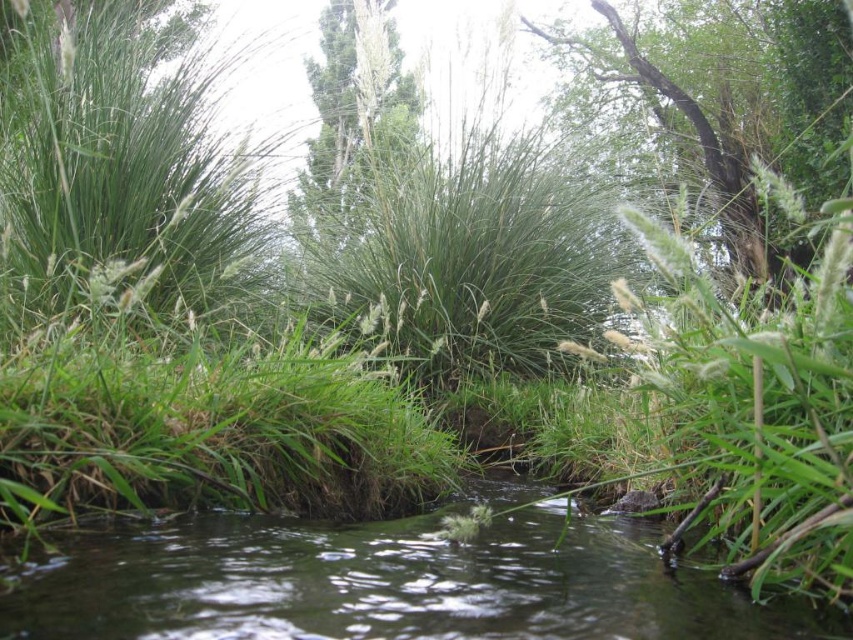
Between green grassy river at center and green grassy plant at upper center, which one has less height?

green grassy river at center

Which is more to the left, green grassy river at center or green grassy plant at upper center?

From the viewer's perspective, green grassy plant at upper center appears more on the left side.

Which is behind, point (25, 608) or point (332, 20)?

Point (332, 20)

The image size is (853, 640). I want to click on green grassy river at center, so click(x=387, y=584).

This screenshot has width=853, height=640. Identify the location of green grassy river at center. tap(387, 584).

Which of these two, green grassy river at center or green rough bark tree at upper center, stands taller?

With more height is green rough bark tree at upper center.

This screenshot has height=640, width=853. What do you see at coordinates (387, 584) in the screenshot? I see `green grassy river at center` at bounding box center [387, 584].

This screenshot has width=853, height=640. In order to click on green grassy river at center in this screenshot , I will do `click(387, 584)`.

Does green grassy plant at upper center come behind green rough bark tree at upper center?

No, green grassy plant at upper center is in front of green rough bark tree at upper center.

Is green grassy plant at upper center to the right of green rough bark tree at upper center from the viewer's perspective?

In fact, green grassy plant at upper center is to the left of green rough bark tree at upper center.

Where is `green grassy plant at upper center`? green grassy plant at upper center is located at coordinates (352, 116).

Where is `green grassy plant at upper center`? This screenshot has width=853, height=640. green grassy plant at upper center is located at coordinates (352, 116).